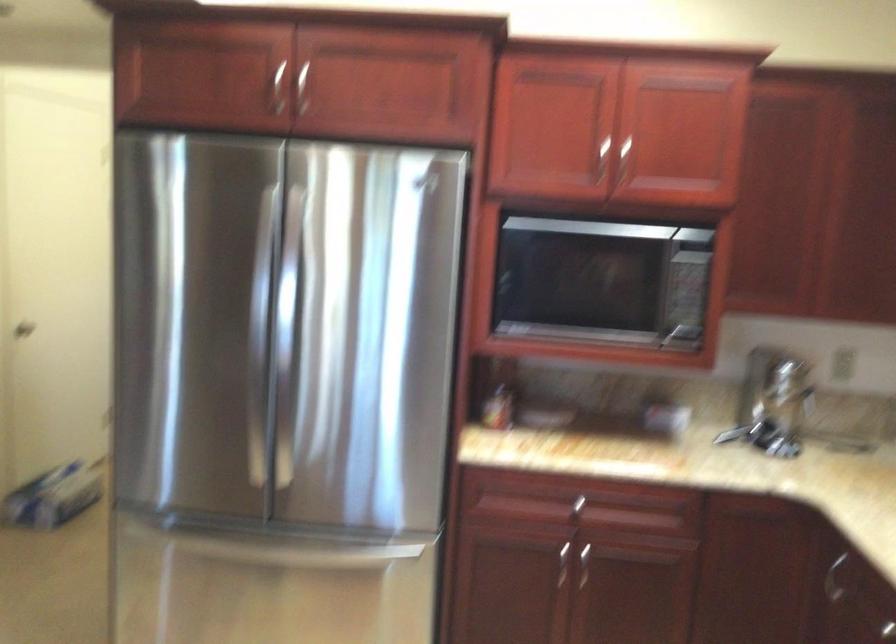
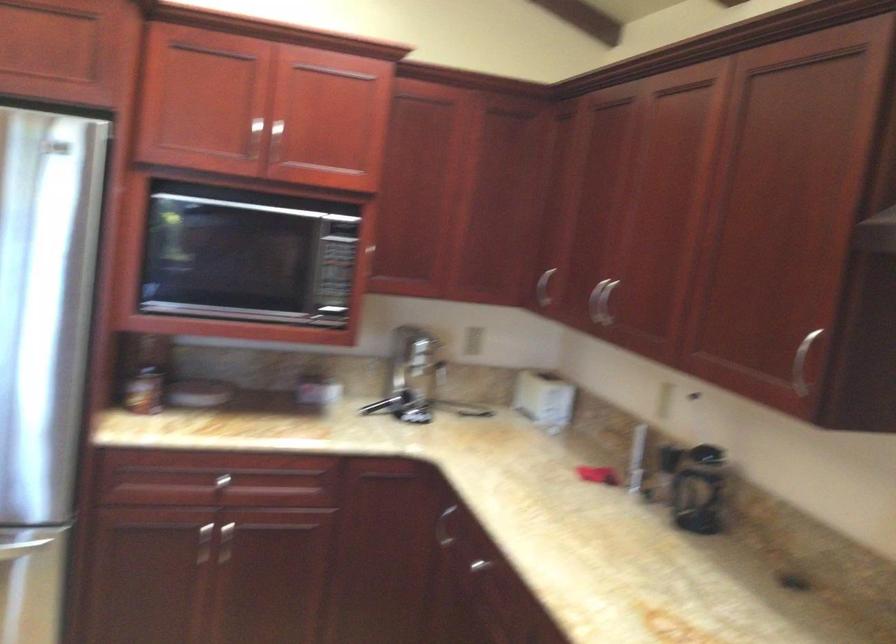
The point at [394,563] is marked in the first image. Where is the corresponding point in the second image?

(21, 547)